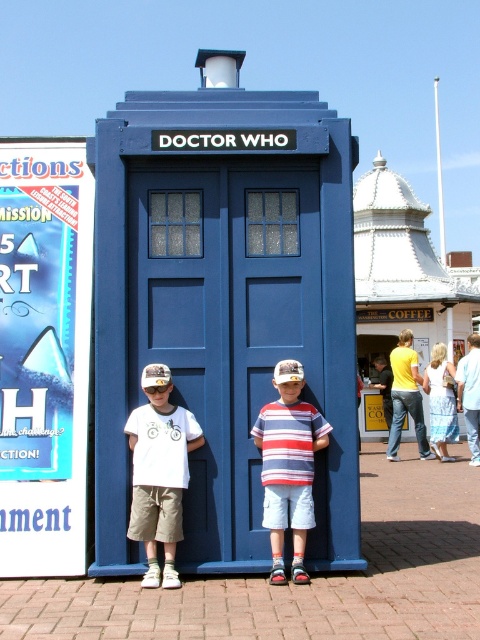
Question: Does striped cotton shirt at center appear on the left side of yellow cotton shirt at center?

Choices:
 (A) yes
 (B) no

Answer: (A)

Question: Which object appears farthest from the camera in this image?

Choices:
 (A) striped cotton shirt at center
 (B) white cotton shirt at center
 (C) yellow cotton shirt at center

Answer: (C)

Question: Considering the real-world distances, which object is closest to the striped cotton shirt at center?

Choices:
 (A) yellow cotton shirt at center
 (B) white cotton shirt at center

Answer: (B)

Question: Is white cotton shirt at center wider than striped cotton shirt at center?

Choices:
 (A) no
 (B) yes

Answer: (B)

Question: Can you confirm if white cotton shirt at center is smaller than striped cotton shirt at center?

Choices:
 (A) no
 (B) yes

Answer: (B)

Question: Which of the following is the closest to the observer?

Choices:
 (A) (159, 403)
 (B) (440, 369)

Answer: (A)